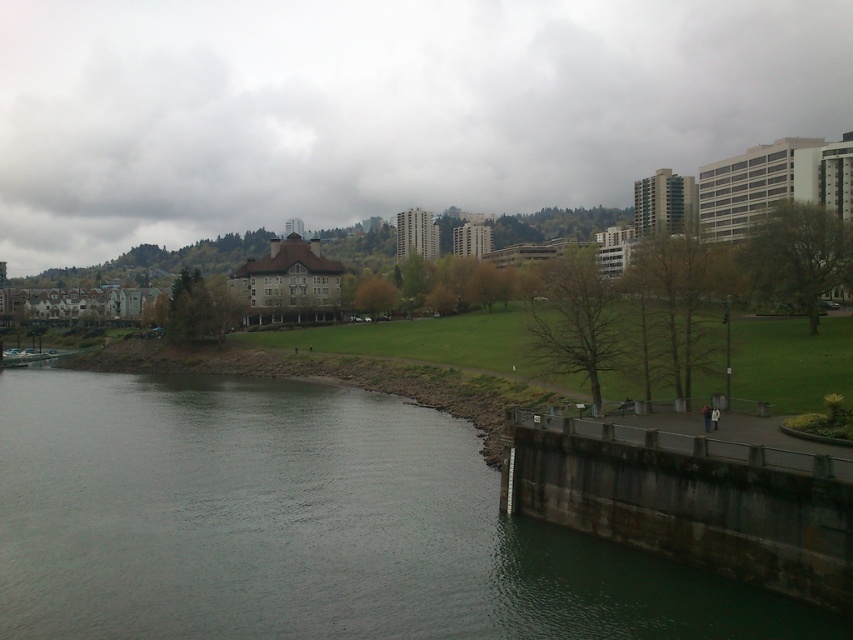
What do you see at coordinates (381, 108) in the screenshot? I see `green grass at center` at bounding box center [381, 108].

Can you confirm if green grass at center is thinner than dark gray concrete river at lower left?

In fact, green grass at center might be wider than dark gray concrete river at lower left.

Locate an element on the screen. The height and width of the screenshot is (640, 853). green grass at center is located at coordinates (381, 108).

This screenshot has width=853, height=640. What are the coordinates of `green grass at center` in the screenshot? It's located at (381, 108).

Describe the element at coordinates (306, 525) in the screenshot. This screenshot has width=853, height=640. I see `dark gray concrete river at lower left` at that location.

Does dark gray concrete river at lower left have a larger size compared to dark gray concrete dam at lower right?

Yes, dark gray concrete river at lower left is bigger than dark gray concrete dam at lower right.

Which is in front, point (177, 470) or point (558, 435)?

Point (558, 435) is in front.

Identify the location of dark gray concrete river at lower left. point(306,525).

Who is shorter, green grass at center or dark gray concrete dam at lower right?

dark gray concrete dam at lower right

This screenshot has width=853, height=640. Describe the element at coordinates (381, 108) in the screenshot. I see `green grass at center` at that location.

The width and height of the screenshot is (853, 640). I want to click on green grass at center, so click(381, 108).